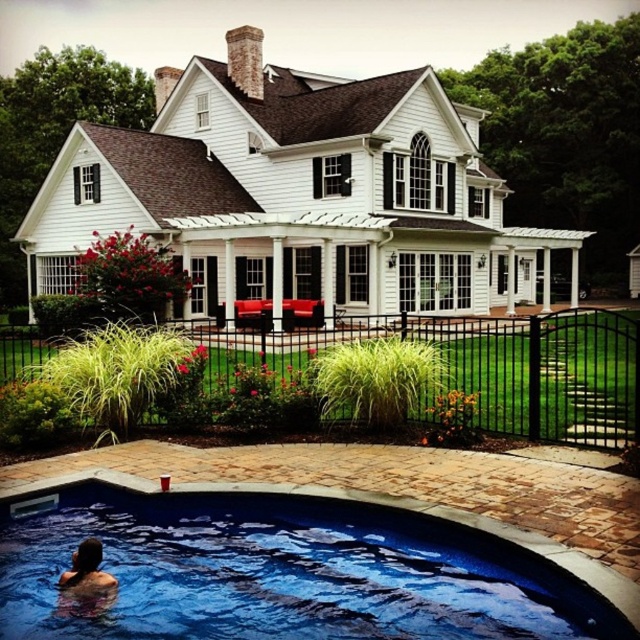
You are planning to install a new rectangular deck that is 2 meters wide between the blue smooth water at lower center and the smooth skin person at lower left. Based on the scene description, will the deck fit between them?

The blue smooth water at lower center is wider than the smooth skin person at lower left, so the deck might fit, but the exact dimensions aren

You are a guest at this suburban home and want to take a photo of the blue smooth water at lower center and the smooth skin person at lower left. Which object should you focus on first if you want to capture both in the same frame without moving the camera?

The blue smooth water at lower center is larger in size compared to the smooth skin person at lower left, so you should focus on the blue smooth water at lower center first to ensure it fills the frame appropriately before adjusting for the smaller subject.

You are standing on the brick patio and want to get to the swimming pool. Which direction should you walk to reach the blue smooth water at lower center first before the smooth skin person at lower left?

You should walk to the right because the blue smooth water at lower center is to the right of the smooth skin person at lower left, so moving right will lead you directly to the water first.